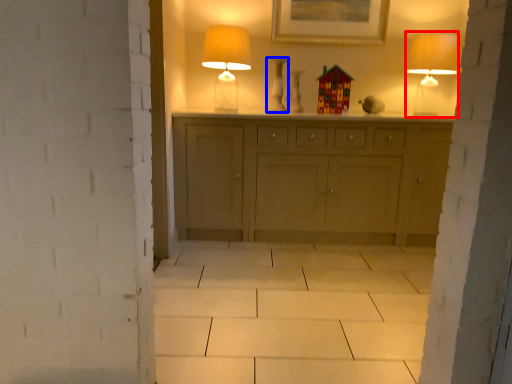
Question: Which of the following is the farthest to the observer, table lamp (highlighted by a red box) or vase (highlighted by a blue box)?

Choices:
 (A) table lamp
 (B) vase

Answer: (B)